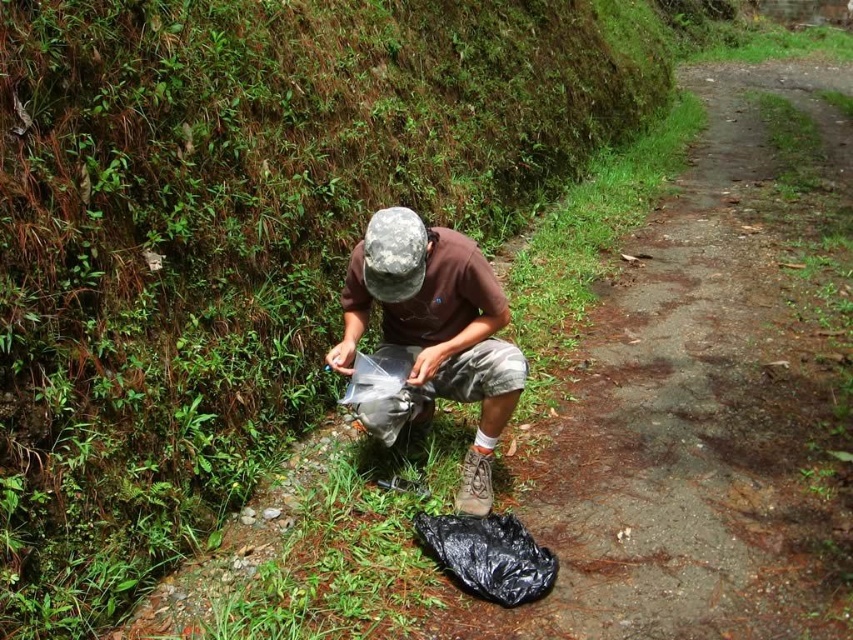
Question: Which of the following is the farthest from the observer?

Choices:
 (A) (367, 298)
 (B) (436, 540)
 (C) (392, 420)

Answer: (A)

Question: Estimate the real-world distances between objects in this image. Which object is closer to the matte gray cap at center?

Choices:
 (A) black plastic bag at lower center
 (B) transparent plastic bag at center

Answer: (B)

Question: Among these objects, which one is nearest to the camera?

Choices:
 (A) transparent plastic bag at center
 (B) matte gray cap at center
 (C) black plastic bag at lower center

Answer: (C)

Question: Observing the image, what is the correct spatial positioning of black plastic bag at lower center in reference to transparent plastic bag at center?

Choices:
 (A) above
 (B) below

Answer: (B)

Question: Does matte gray cap at center appear over black plastic bag at lower center?

Choices:
 (A) no
 (B) yes

Answer: (B)

Question: Does matte gray cap at center appear over transparent plastic bag at center?

Choices:
 (A) yes
 (B) no

Answer: (A)